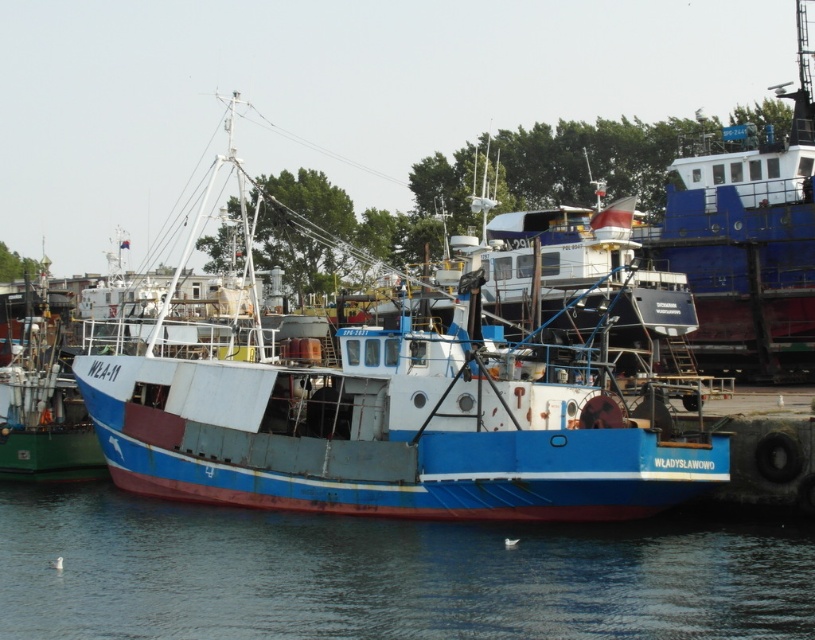
You are standing on the dock and see the blue painted metal boat at center and the blue water at lower center. Which object is positioned higher relative to the other?

The blue painted metal boat at center is located above the blue water at lower center, so it is positioned higher.

You are standing at the point indicated by coordinates point (386, 413) in the harbor scene. What object are you directly facing?

The point (386, 413) indicates blue painted metal boat at center, so you are directly facing the blue painted metal boat at center.